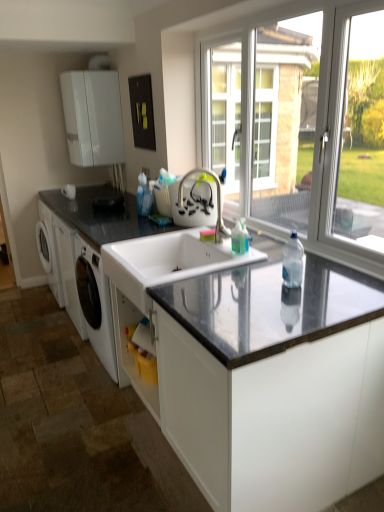
The image size is (384, 512). Identify the location of free space to the back side of clear plastic bottle at center. pyautogui.click(x=266, y=269).